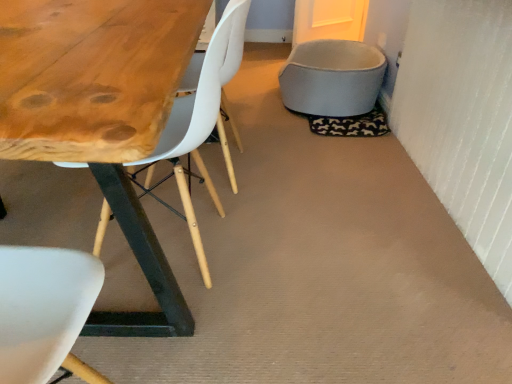
Question: Does white plastic chair at upper left have a larger size compared to soft fabric pet bed at upper right?

Choices:
 (A) no
 (B) yes

Answer: (B)

Question: From the image's perspective, does white plastic chair at upper left appear higher than soft fabric pet bed at upper right?

Choices:
 (A) yes
 (B) no

Answer: (B)

Question: From a real-world perspective, is white plastic chair at upper left positioned over soft fabric pet bed at upper right based on gravity?

Choices:
 (A) yes
 (B) no

Answer: (A)

Question: Considering the relative sizes of white plastic chair at upper left and soft fabric pet bed at upper right in the image provided, is white plastic chair at upper left smaller than soft fabric pet bed at upper right?

Choices:
 (A) no
 (B) yes

Answer: (A)

Question: From a real-world perspective, does white plastic chair at upper left sit lower than soft fabric pet bed at upper right?

Choices:
 (A) no
 (B) yes

Answer: (A)

Question: Is white plastic chair at upper left aimed at soft fabric pet bed at upper right?

Choices:
 (A) no
 (B) yes

Answer: (A)

Question: Is white plastic chair at upper left behind white matte chair at center?

Choices:
 (A) no
 (B) yes

Answer: (A)

Question: Is white plastic chair at upper left thinner than white matte chair at center?

Choices:
 (A) no
 (B) yes

Answer: (A)

Question: Is white plastic chair at upper left to the left of white matte chair at center from the viewer's perspective?

Choices:
 (A) no
 (B) yes

Answer: (B)

Question: Is white plastic chair at upper left outside of white matte chair at center?

Choices:
 (A) no
 (B) yes

Answer: (B)

Question: Is white plastic chair at upper left with white matte chair at center?

Choices:
 (A) no
 (B) yes

Answer: (A)

Question: From a real-world perspective, is white plastic chair at upper left located higher than white matte chair at center?

Choices:
 (A) yes
 (B) no

Answer: (A)

Question: From the image's perspective, would you say soft fabric pet bed at upper right is shown under white plastic chair at upper left?

Choices:
 (A) no
 (B) yes

Answer: (A)